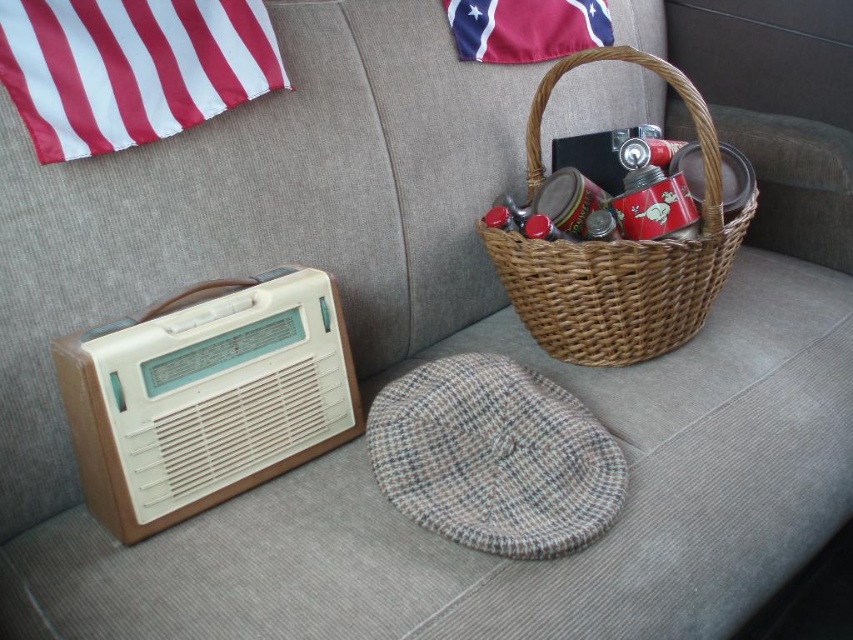
Based on the photo, is red/white striped fabric at upper left below red cotton flag at upper center?

Yes, red/white striped fabric at upper left is below red cotton flag at upper center.

Does point (198, 44) lie in front of point (544, 3)?

Yes, it is.

Is point (45, 60) closer to viewer compared to point (577, 38)?

That is True.

The width and height of the screenshot is (853, 640). I want to click on red/white striped fabric at upper left, so click(x=131, y=67).

Does red/white striped fabric at upper left appear over woven brown basket at center?

Yes, red/white striped fabric at upper left is above woven brown basket at center.

Is red/white striped fabric at upper left taller than woven brown basket at center?

In fact, red/white striped fabric at upper left may be shorter than woven brown basket at center.

Which is in front, point (109, 134) or point (677, 76)?

Point (109, 134) is in front.

Where is `red/white striped fabric at upper left`? Image resolution: width=853 pixels, height=640 pixels. red/white striped fabric at upper left is located at coordinates (x=131, y=67).

Does woven brown basket at center have a greater width compared to red cotton flag at upper center?

Yes.

Who is taller, woven brown basket at center or red cotton flag at upper center?

woven brown basket at center is taller.

Is point (628, 323) less distant than point (572, 26)?

That is True.

At what (x,y) coordinates should I click in order to perform the action: click on woven brown basket at center. Please return your answer as a coordinate pair (x, y). Image resolution: width=853 pixels, height=640 pixels. Looking at the image, I should click on pyautogui.click(x=618, y=253).